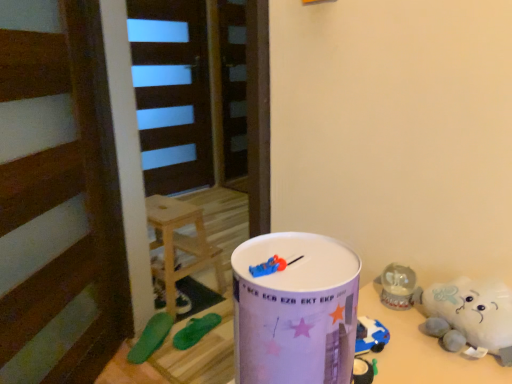
Find the location of a particular element. vacant space to the right of green rubber toy at lower left, arranged as the third toy when viewed from the front is located at coordinates (196, 297).